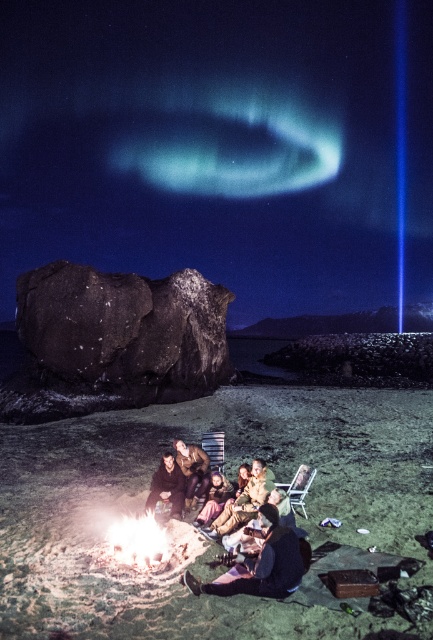
You are standing at the edge of the campfire and want to grab your jacket. You see two jackets near the fire. Which jacket is closer to the right side of the fire? The dark brown leather jacket at center or the brown leather jacket at lower center?

The dark brown leather jacket at center is to the right of the brown leather jacket at lower center, so the dark brown leather jacket at center is closer to the right side of the fire.